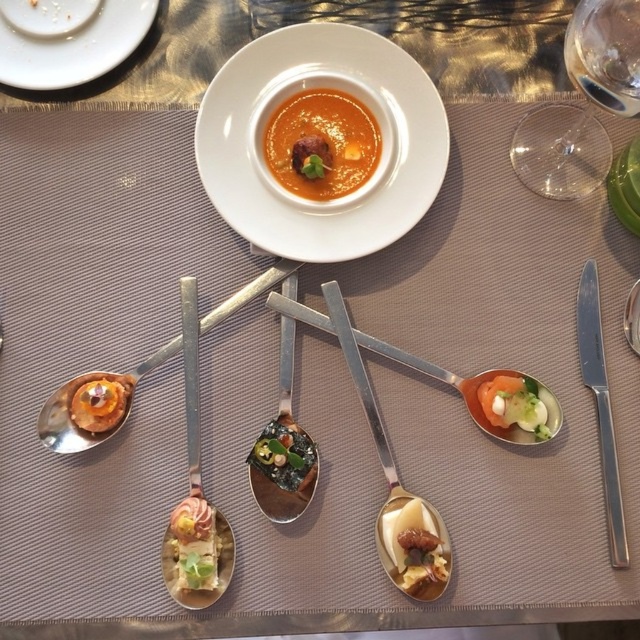
Question: Among these objects, which one is nearest to the camera?

Choices:
 (A) white glossy plate at center
 (B) transparent glass at upper right
 (C) shiny silver spoon at upper left
 (D) white glossy plate at upper left

Answer: (B)

Question: Which point is closer to the camera?

Choices:
 (A) (376, 83)
 (B) (38, 60)

Answer: (A)

Question: Is white glossy plate at upper left wider than smooth orange soup at center?

Choices:
 (A) no
 (B) yes

Answer: (B)

Question: Is white glossy plate at upper left wider than green matte seaweed at center?

Choices:
 (A) no
 (B) yes

Answer: (B)

Question: Estimate the real-world distances between objects in this image. Which object is farther from the shiny silver spoon at center?

Choices:
 (A) white glossy plate at center
 (B) green matte seaweed at center
 (C) shiny metallic spoon at center
 (D) green matte vegetable at upper center

Answer: (D)

Question: Is white glossy plate at center above matte gold spoon at lower left?

Choices:
 (A) yes
 (B) no

Answer: (A)